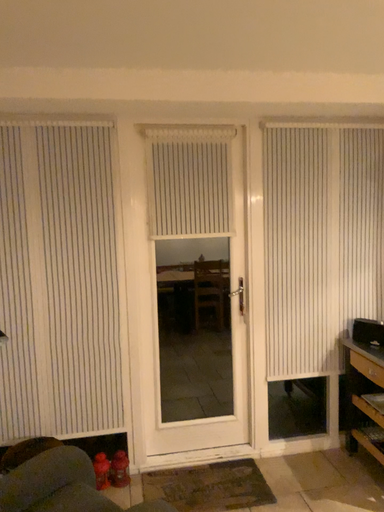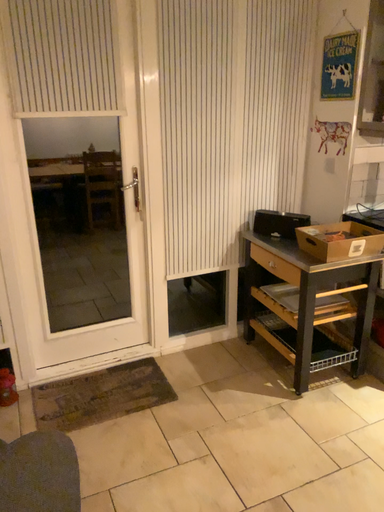
Question: How did the camera likely rotate when shooting the video?

Choices:
 (A) rotated left
 (B) rotated right

Answer: (B)